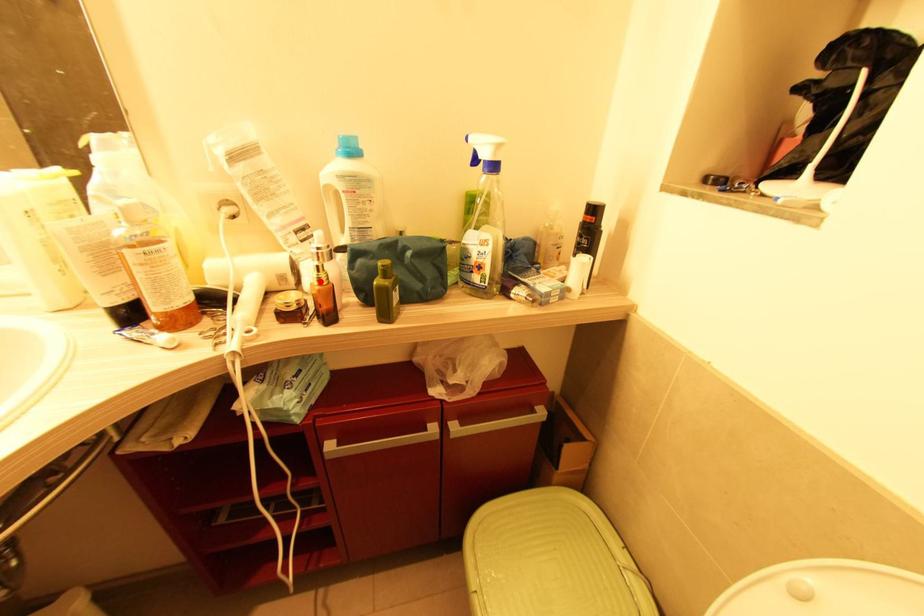
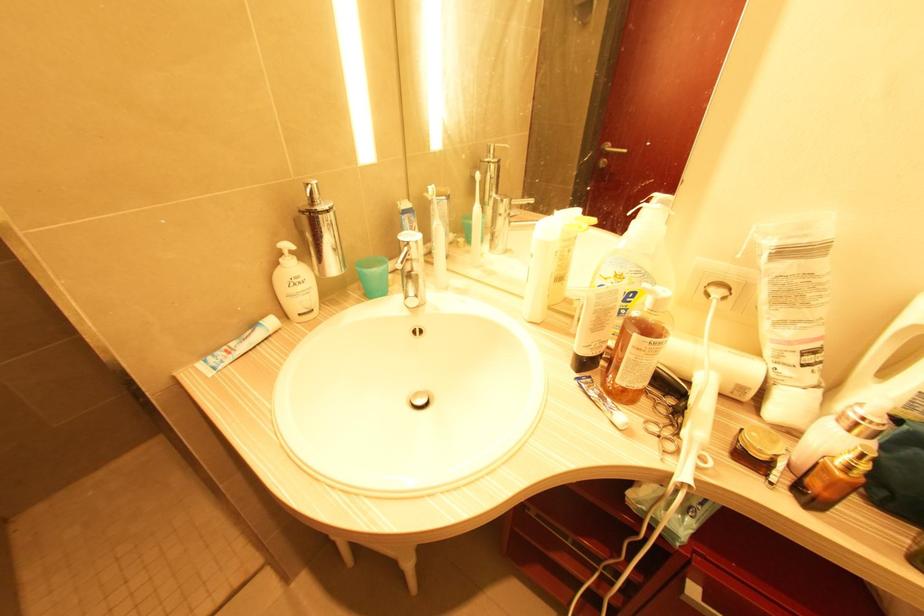
In the second image, find the point that corresponds to the highlighted location in the first image.

(850, 468)